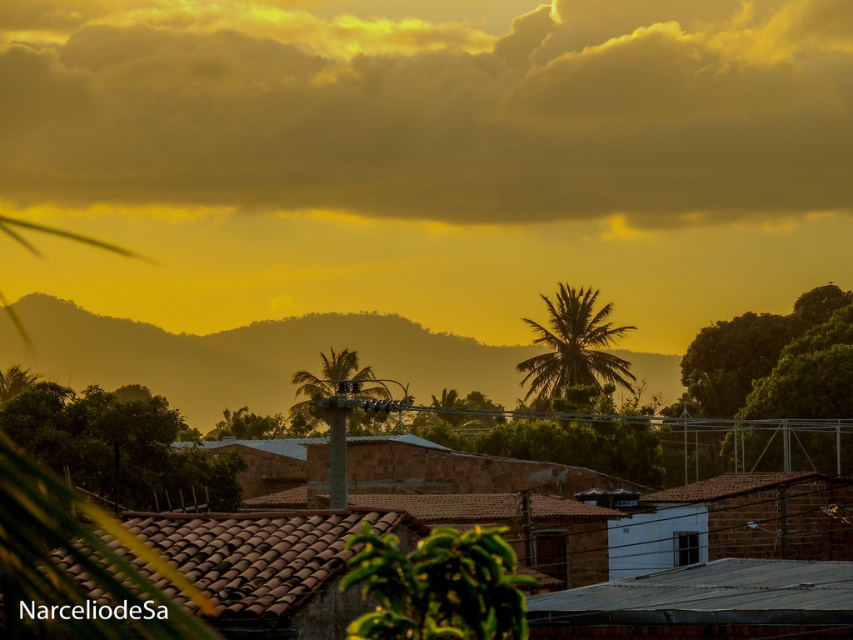
Who is more distant from viewer, (556, 364) or (332, 349)?

Positioned behind is point (332, 349).

Is green leafy palm at center taller than green leafy palm tree at center?

Yes.

Where is `green leafy palm at center`? green leafy palm at center is located at coordinates (573, 346).

Is point (792, 145) less distant than point (543, 332)?

No, it is not.

Find the location of a particular element. The height and width of the screenshot is (640, 853). cloudy textured sky at upper center is located at coordinates (431, 108).

Can you confirm if cloudy textured sky at upper center is smaller than green leafy palm tree at center?

No, cloudy textured sky at upper center is not smaller than green leafy palm tree at center.

Who is positioned more to the right, cloudy textured sky at upper center or green leafy palm tree at center?

From the viewer's perspective, green leafy palm tree at center appears more on the right side.

Is point (434, 84) positioned in front of point (334, 492)?

No, (434, 84) is further to viewer.

Locate an element on the screen. Image resolution: width=853 pixels, height=640 pixels. cloudy textured sky at upper center is located at coordinates (431, 108).